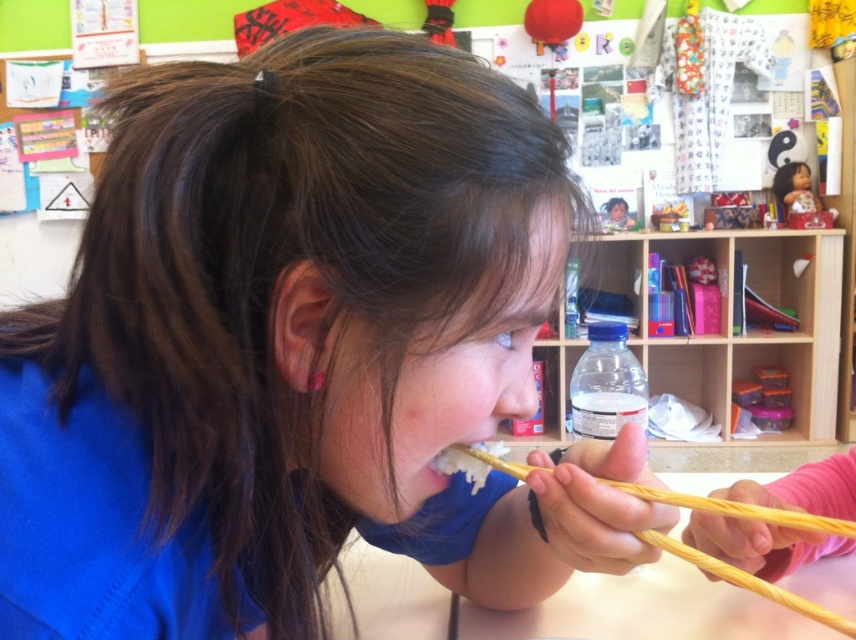
Is wooden chopsticks at lower center below smooth porcelain doll at upper right?

Yes.

Does wooden chopsticks at lower center appear on the left side of smooth porcelain doll at upper right?

Indeed, wooden chopsticks at lower center is positioned on the left side of smooth porcelain doll at upper right.

Identify the location of wooden chopsticks at lower center. (643, 611).

Between wooden chopsticks at lower center and smooth skin face at upper center, which one appears on the left side from the viewer's perspective?

From the viewer's perspective, wooden chopsticks at lower center appears more on the left side.

Is wooden chopsticks at lower center thinner than smooth skin face at upper center?

In fact, wooden chopsticks at lower center might be wider than smooth skin face at upper center.

At what (x,y) coordinates should I click in order to perform the action: click on wooden chopsticks at lower center. Please return your answer as a coordinate pair (x, y). The image size is (856, 640). Looking at the image, I should click on point(643,611).

Can you confirm if smooth skin face at center is positioned to the right of wooden chopsticks at lower center?

In fact, smooth skin face at center is to the left of wooden chopsticks at lower center.

Can you confirm if smooth skin face at center is wider than wooden chopsticks at lower center?

Incorrect, smooth skin face at center's width does not surpass wooden chopsticks at lower center's.

Measure the distance between point (337, 472) and camera.

Point (337, 472) and camera are 16.18 inches apart.

At what (x,y) coordinates should I click in order to perform the action: click on smooth skin face at center. Please return your answer as a coordinate pair (x, y). This screenshot has height=640, width=856. Looking at the image, I should click on (437, 381).